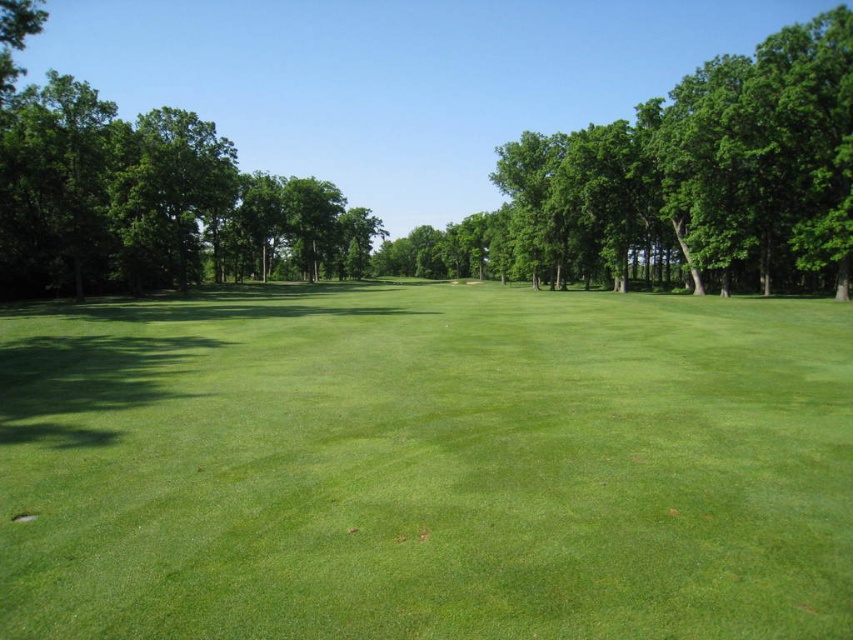
Question: Which point appears farthest from the camera in this image?

Choices:
 (A) (20, 518)
 (B) (412, 358)

Answer: (B)

Question: Can you confirm if green grassy field at center is thinner than green leafy tree at center?

Choices:
 (A) no
 (B) yes

Answer: (B)

Question: Based on their relative distances, which object is nearer to the green smooth hole at lower left?

Choices:
 (A) green leafy tree at center
 (B) green grassy field at center

Answer: (B)

Question: Does green leafy tree at center have a smaller size compared to green smooth hole at lower left?

Choices:
 (A) no
 (B) yes

Answer: (A)

Question: Is green grassy field at center below green smooth hole at lower left?

Choices:
 (A) yes
 (B) no

Answer: (B)

Question: Among these points, which one is nearest to the camera?

Choices:
 (A) (36, 435)
 (B) (312, 259)
 (C) (20, 522)

Answer: (C)